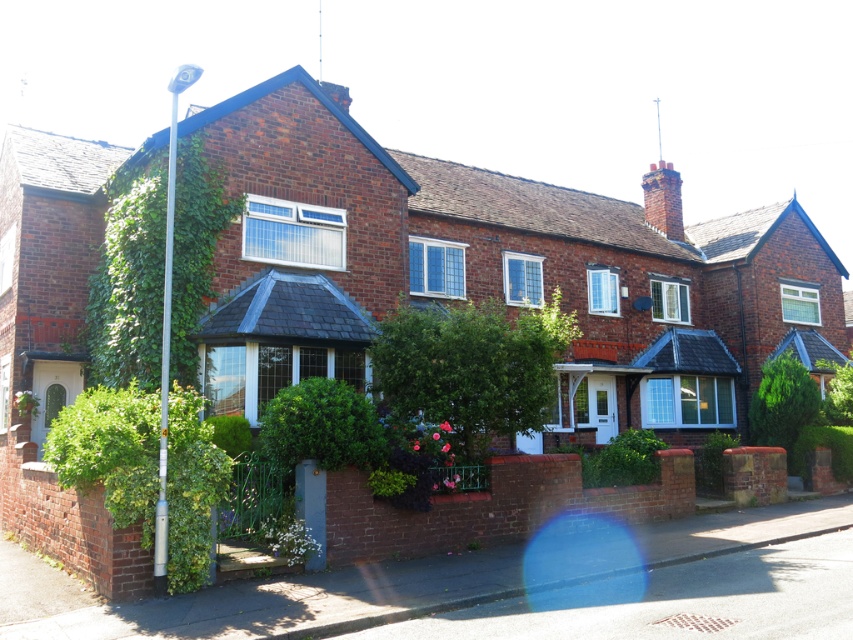
Which is in front, point (177, 358) or point (492, 332)?

Point (492, 332) is in front.

Which is behind, point (215, 221) or point (467, 404)?

The point (215, 221) is behind.

The width and height of the screenshot is (853, 640). What are the coordinates of `green leafy ivy at left` in the screenshot? It's located at (129, 282).

Can you confirm if green leafy ivy at center is wider than green leafy ivy at lower left?

No, green leafy ivy at center is not wider than green leafy ivy at lower left.

Does green leafy ivy at center have a larger size compared to green leafy ivy at lower left?

No, green leafy ivy at center is not bigger than green leafy ivy at lower left.

Find the location of a particular element. The width and height of the screenshot is (853, 640). green leafy ivy at center is located at coordinates (473, 365).

Can you confirm if green leafy ivy at left is thinner than green leafy ivy at lower left?

No.

The width and height of the screenshot is (853, 640). In order to click on green leafy ivy at left in this screenshot , I will do `click(129, 282)`.

This screenshot has width=853, height=640. In order to click on green leafy ivy at left in this screenshot , I will do `click(129, 282)`.

Identify the location of green leafy ivy at left. (129, 282).